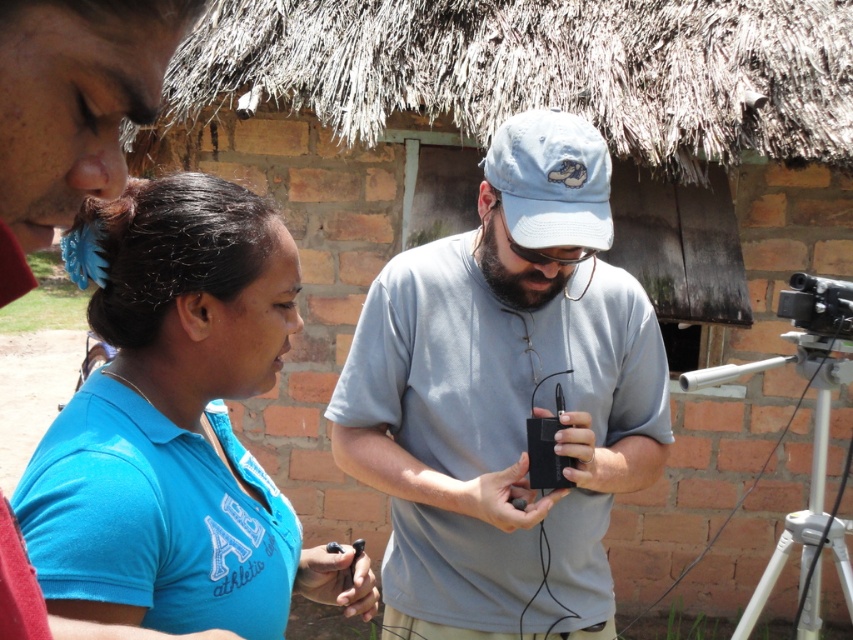
Question: Is black matte speaker at center bigger than blue fabric shirt at center?

Choices:
 (A) yes
 (B) no

Answer: (A)

Question: Can you confirm if white plastic tripod at lower right is wider than black plastic video camera at right?

Choices:
 (A) yes
 (B) no

Answer: (A)

Question: Is black matte speaker at center thinner than white plastic tripod at lower right?

Choices:
 (A) no
 (B) yes

Answer: (A)

Question: Estimate the real-world distances between objects in this image. Which object is farther from the white plastic tripod at lower right?

Choices:
 (A) black plastic video camera at right
 (B) blue fabric shirt at center

Answer: (B)

Question: Which object is positioned closest to the black matte speaker at center?

Choices:
 (A) light blue fabric baseball cap at center
 (B) blue fabric shirt at center
 (C) black plastic video camera at right
 (D) white plastic tripod at lower right

Answer: (A)

Question: Which of these objects is positioned closest to the blue fabric shirt at center?

Choices:
 (A) black plastic video camera at right
 (B) light blue fabric baseball cap at center
 (C) black matte speaker at center
 (D) white plastic tripod at lower right

Answer: (C)